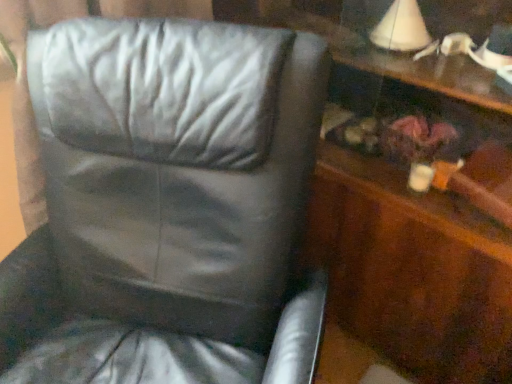
Question: Considering the relative positions of black leather chair at center and wooden dresser at right in the image provided, is black leather chair at center to the left or to the right of wooden dresser at right?

Choices:
 (A) left
 (B) right

Answer: (A)

Question: Is black leather chair at center situated inside wooden dresser at right or outside?

Choices:
 (A) outside
 (B) inside

Answer: (A)

Question: From their relative heights in the image, would you say black leather chair at center is taller or shorter than wooden dresser at right?

Choices:
 (A) tall
 (B) short

Answer: (B)

Question: From the image's perspective, is wooden dresser at right positioned above or below black leather chair at center?

Choices:
 (A) below
 (B) above

Answer: (B)

Question: From a real-world perspective, relative to black leather chair at center, is wooden dresser at right vertically above or below?

Choices:
 (A) below
 (B) above

Answer: (B)

Question: Is wooden dresser at right in front of or behind black leather chair at center in the image?

Choices:
 (A) front
 (B) behind

Answer: (B)

Question: Considering the relative positions of wooden dresser at right and black leather chair at center in the image provided, is wooden dresser at right to the left or to the right of black leather chair at center?

Choices:
 (A) right
 (B) left

Answer: (A)